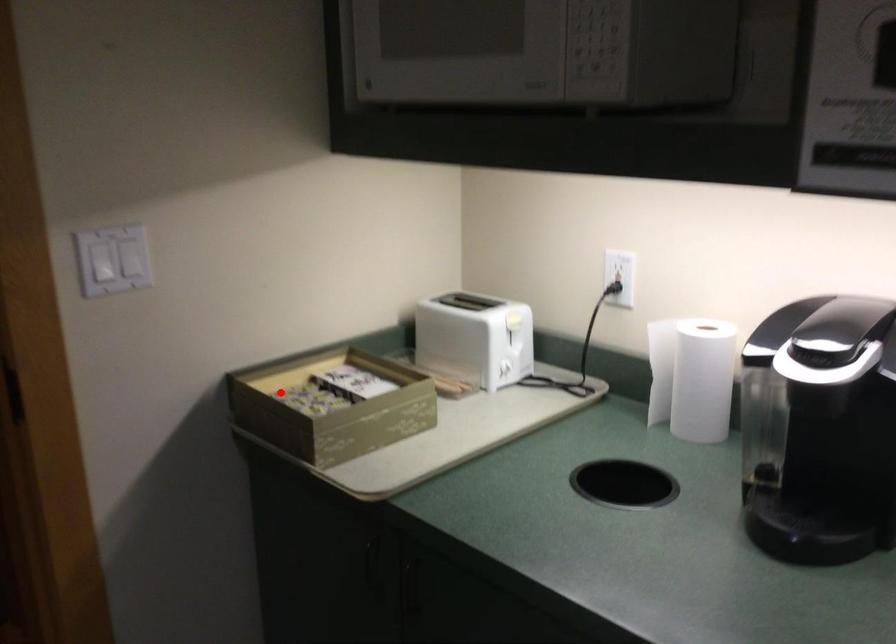
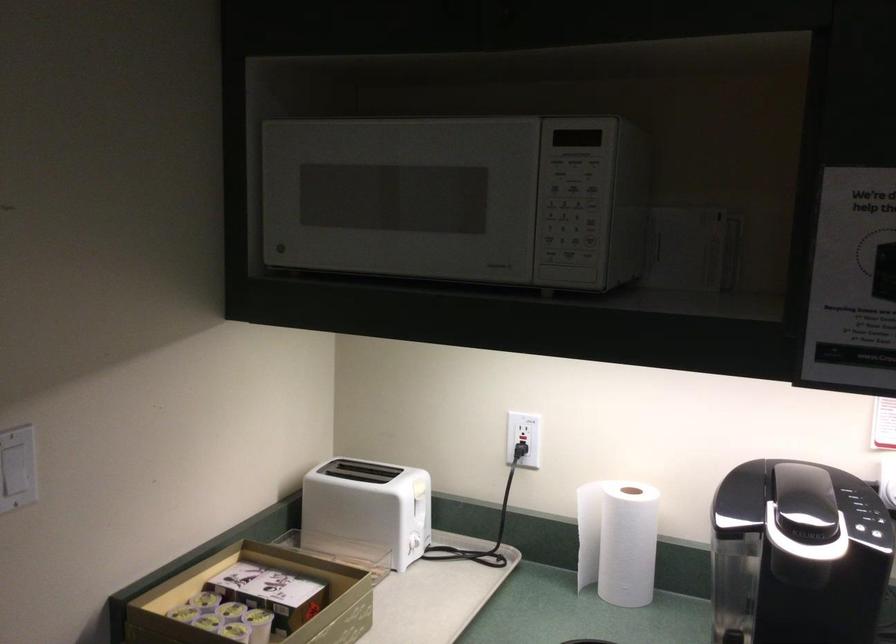
Question: I am providing you with two images of the same scene from different viewpoints. Image1 has a red point marked. In image2, the corresponding 3D location appears at what relative position? Reply with the corresponding letter.

Choices:
 (A) Closer
 (B) Farther

Answer: (A)